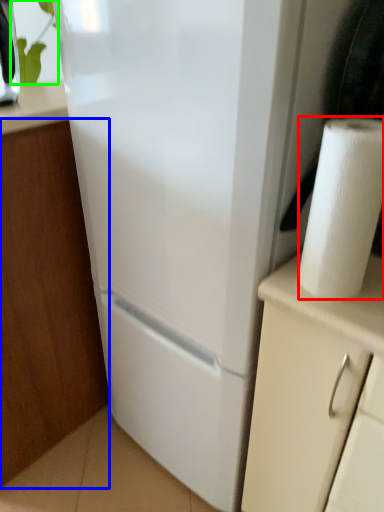
Question: Which object is the closest to the paper towel (highlighted by a red box)? Choose among these: cabinetry (highlighted by a blue box) or plant (highlighted by a green box).

Choices:
 (A) cabinetry
 (B) plant

Answer: (A)